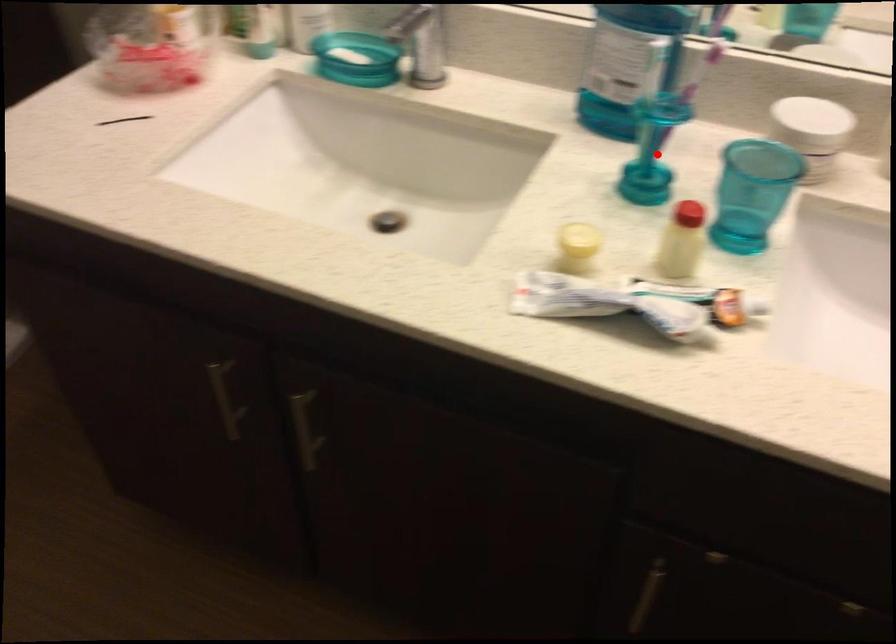
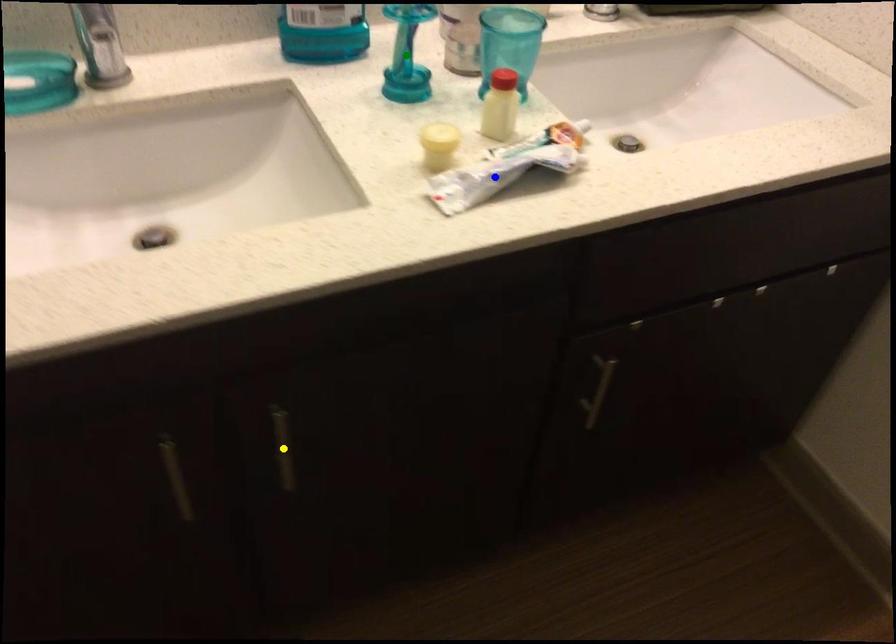
Question: I am providing you with two images of the same scene from different viewpoints. A red point is marked on the first image. You are given multiple points on the second image. Can you choose the point in image 2 that corresponds to the point in image 1?

Choices:
 (A) green point
 (B) blue point
 (C) yellow point

Answer: (A)